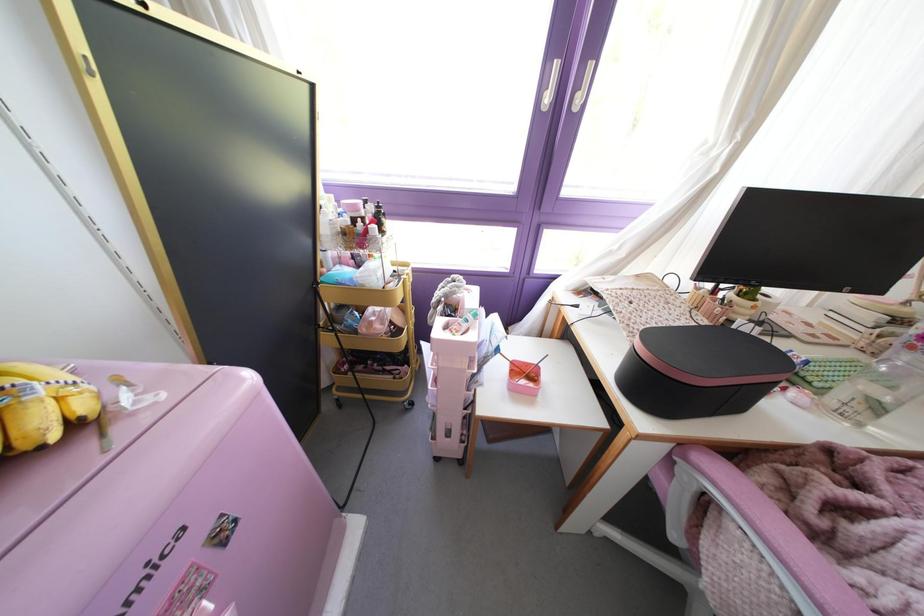
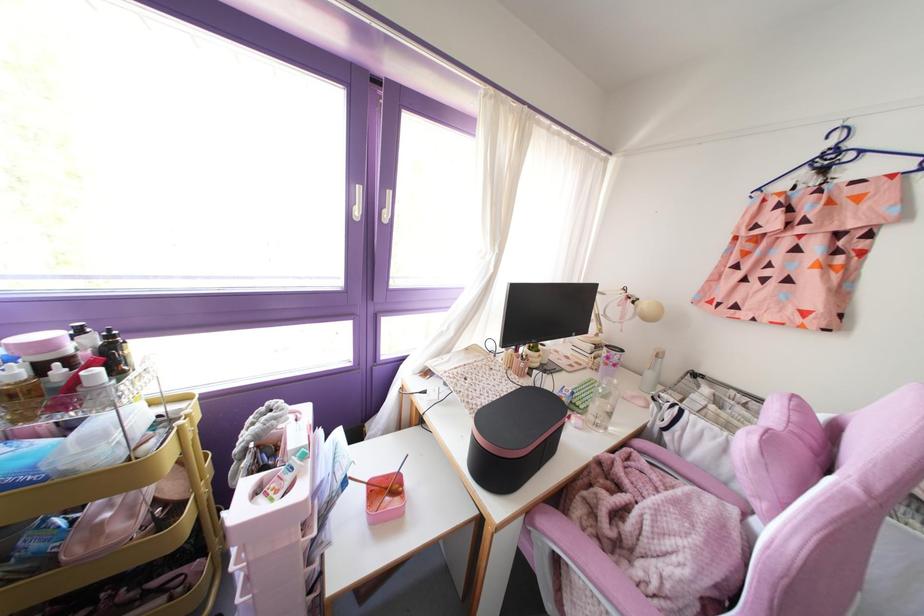
Locate, in the second image, the point that corresponds to the point at 682,445 in the first image.

(528, 513)